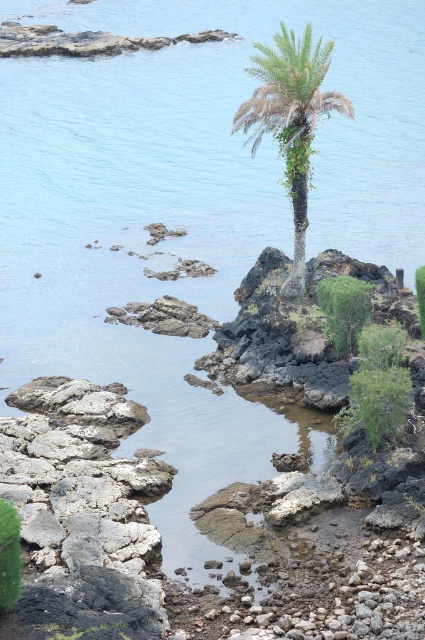
Between point (155, 472) and point (297, 120), which one is positioned in front?

Point (155, 472) is in front.

Is point (119, 404) behind point (234, 116)?

That is False.

Which is behind, point (67, 531) or point (238, 115)?

The point (238, 115) is behind.

Where is `gray rough rock at lower left`? gray rough rock at lower left is located at coordinates (81, 515).